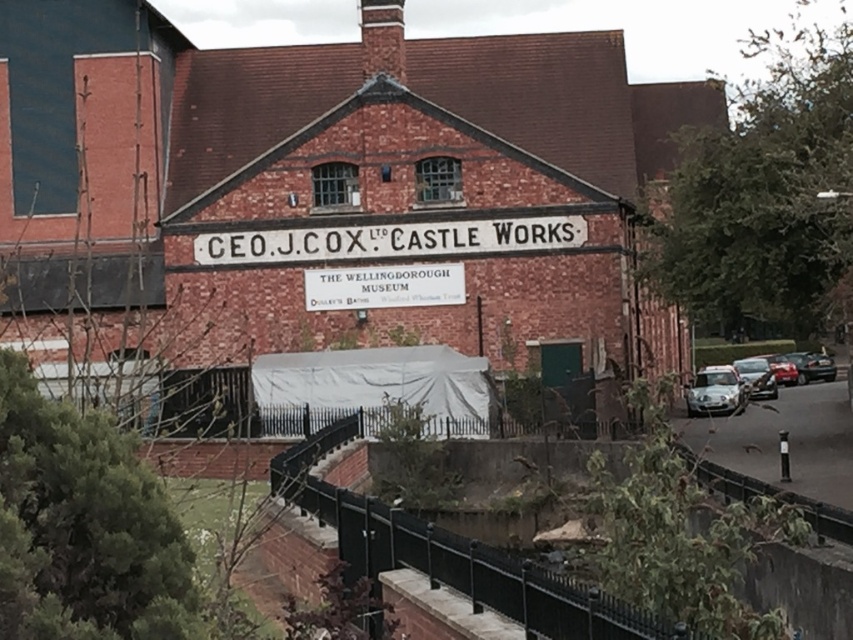
Question: Can you confirm if white paper sign at center is smaller than shiny silver car at right?

Choices:
 (A) no
 (B) yes

Answer: (B)

Question: Considering the relative positions of white painted wood sign at center and silver metallic car at right in the image provided, where is white painted wood sign at center located with respect to silver metallic car at right?

Choices:
 (A) left
 (B) right

Answer: (A)

Question: Among these points, which one is nearest to the camera?

Choices:
 (A) (308, 300)
 (B) (566, 218)

Answer: (B)

Question: Which of the following is the farthest from the observer?

Choices:
 (A) (354, 276)
 (B) (723, 404)
 (C) (741, 381)

Answer: (C)

Question: Which point appears farthest from the camera in this image?

Choices:
 (A) (718, 392)
 (B) (701, 390)
 (C) (775, 380)

Answer: (C)

Question: Is white paper sign at center below silver metallic car at right?

Choices:
 (A) no
 (B) yes

Answer: (A)